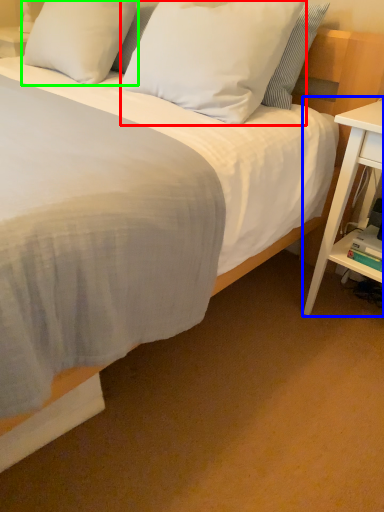
Question: Considering the real-world distances, which object is closest to pillow (highlighted by a red box)? nightstand (highlighted by a blue box) or pillow (highlighted by a green box).

Choices:
 (A) nightstand
 (B) pillow

Answer: (B)